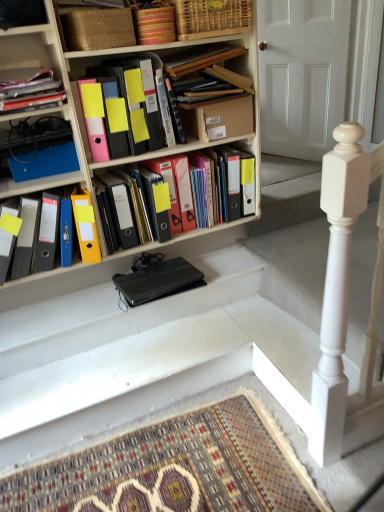
You are a GUI agent. You are given a task and a screenshot of the screen. Output one action in this format:
    pyautogui.click(x=<x>, y=<y>)
    Task: Click on the free point above black matte laptop at center (from a real-world perspective)
    This screenshot has width=384, height=512.
    Given the screenshot: What is the action you would take?
    pyautogui.click(x=167, y=280)